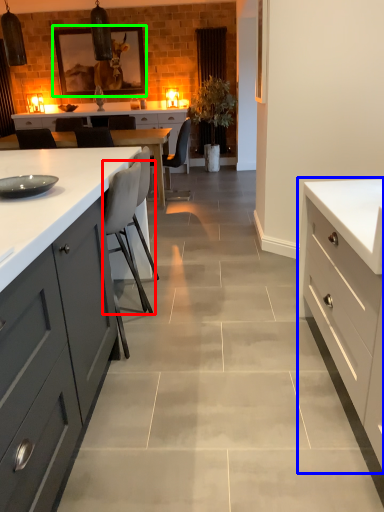
Question: Estimate the real-world distances between objects in this image. Which object is closer to chair (highlighted by a red box), cabinetry (highlighted by a blue box) or picture frame (highlighted by a green box)?

Choices:
 (A) cabinetry
 (B) picture frame

Answer: (A)